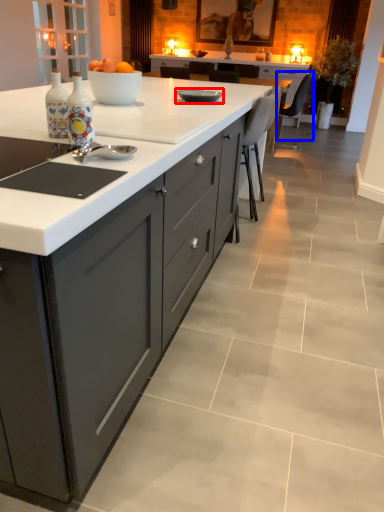
Question: Which point is closer to the camera, kitchen appliance (highlighted by a red box) or chair (highlighted by a blue box)?

Choices:
 (A) kitchen appliance
 (B) chair

Answer: (A)